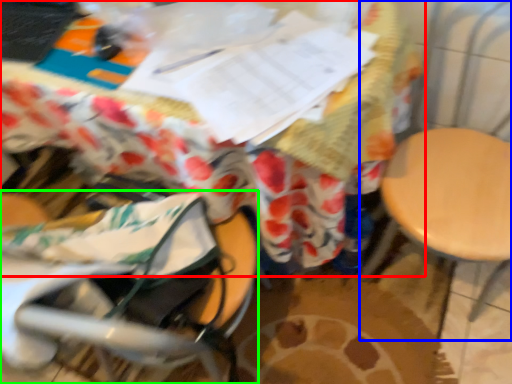
Question: Which is farther away from table (highlighted by a red box)? swivel chair (highlighted by a blue box) or baby carriage (highlighted by a green box)?

Choices:
 (A) swivel chair
 (B) baby carriage

Answer: (A)